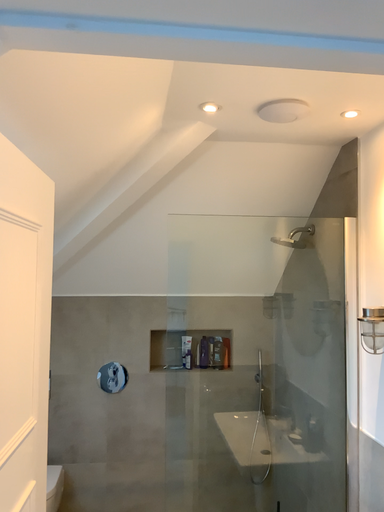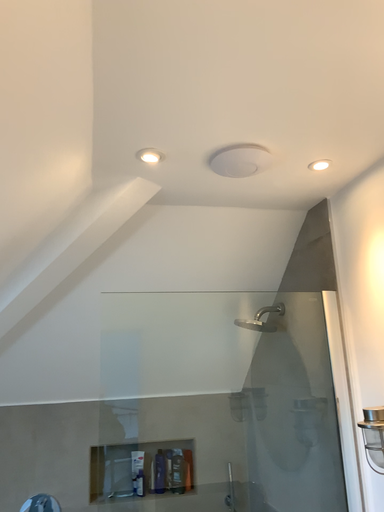
Question: How did the camera likely rotate when shooting the video?

Choices:
 (A) rotated upward
 (B) rotated downward

Answer: (A)